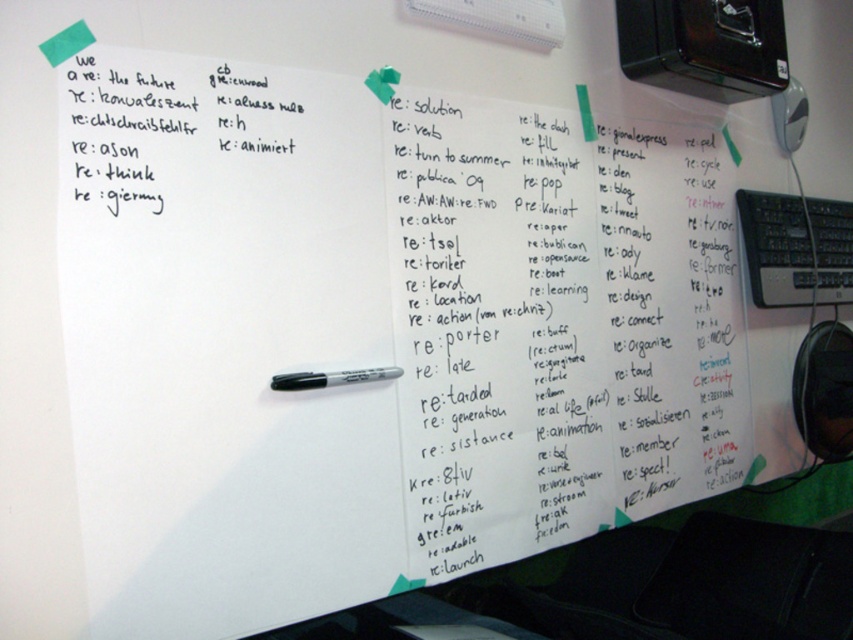
Who is positioned more to the left, black marker pen at center or green matte sticky note at upper left?

From the viewer's perspective, green matte sticky note at upper left appears more on the left side.

Who is more forward, (364,369) or (79,29)?

Point (79,29) is more forward.

Where is `black marker pen at center`? The width and height of the screenshot is (853, 640). black marker pen at center is located at coordinates (331, 378).

Where is `black plastic keyboard at right`? black plastic keyboard at right is located at coordinates (796, 248).

Image resolution: width=853 pixels, height=640 pixels. Describe the element at coordinates (796, 248) in the screenshot. I see `black plastic keyboard at right` at that location.

Locate an element on the screen. The width and height of the screenshot is (853, 640). black plastic keyboard at right is located at coordinates (796, 248).

Is black plastic keyboard at right bigger than black marker pen at center?

Indeed, black plastic keyboard at right has a larger size compared to black marker pen at center.

Does black plastic keyboard at right have a lesser height compared to black marker pen at center?

Incorrect, black plastic keyboard at right's height does not fall short of black marker pen at center's.

Who is more forward, (834, 237) or (375, 374)?

Point (375, 374) is more forward.

You are a GUI agent. You are given a task and a screenshot of the screen. Output one action in this format:
    pyautogui.click(x=<x>, y=<y>)
    Task: Click on the black plastic keyboard at right
    This screenshot has height=640, width=853.
    Given the screenshot: What is the action you would take?
    [x=796, y=248]